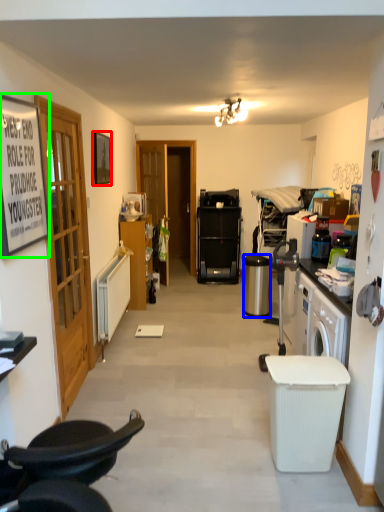
Question: Based on their relative distances, which object is nearer to picture frame (highlighted by a red box)? Choose from trash bin/can (highlighted by a blue box) and picture frame (highlighted by a green box).

Choices:
 (A) trash bin/can
 (B) picture frame

Answer: (B)